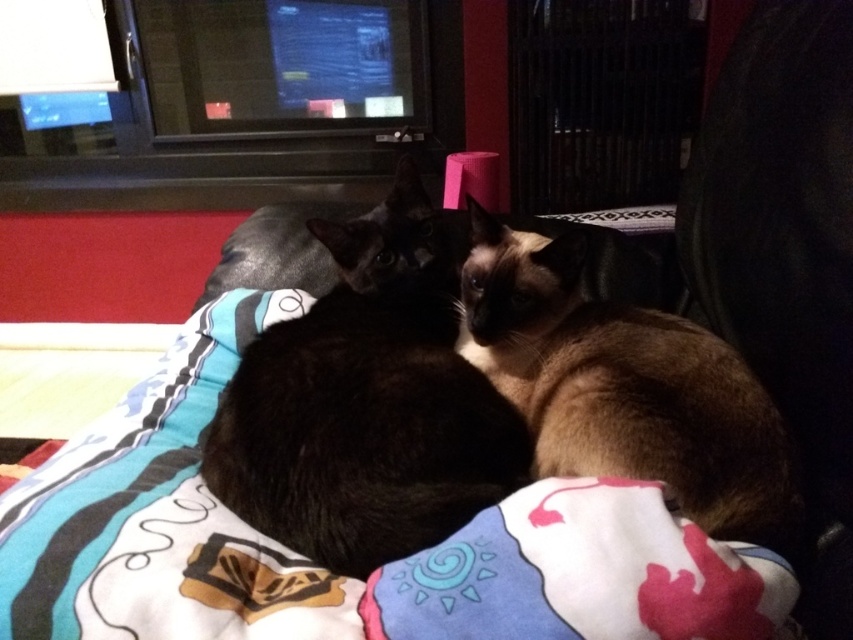
You are trying to determine if the printed cotton blanket at center can fully cover the brown silky cat at center. Based on the scene description, can it?

The printed cotton blanket at center is wider than the brown silky cat at center, so it can fully cover the brown silky cat at center.